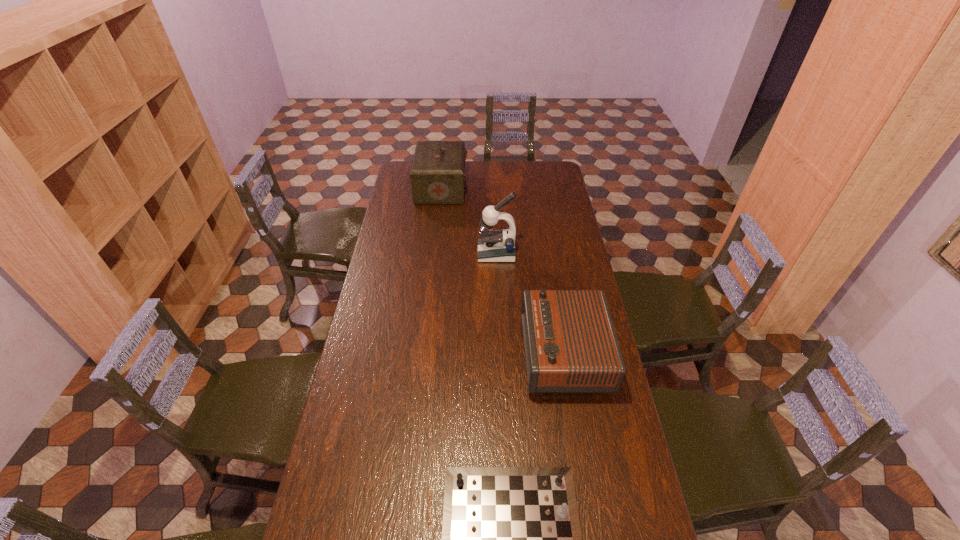
Locate an element on the screen. The height and width of the screenshot is (540, 960). vacant space that is in between the first-aid kit and the third nearest object is located at coordinates [x=468, y=221].

Locate which object ranks third in proximity to the tallest object. Please provide its 2D coordinates. Your answer should be formatted as a tuple, i.e. [(x, y)], where the tuple contains the x and y coordinates of a point satisfying the conditions above.

[(511, 539)]

In order to click on object that stands as the second closest to the second nearest object in this screenshot , I will do `click(495, 245)`.

Find the location of a particular element. Image resolution: width=960 pixels, height=540 pixels. free space that satisfies the following two spatial constraints: 1. on the front side of the first-aid kit; 2. on the right side of the second farthest object is located at coordinates (434, 253).